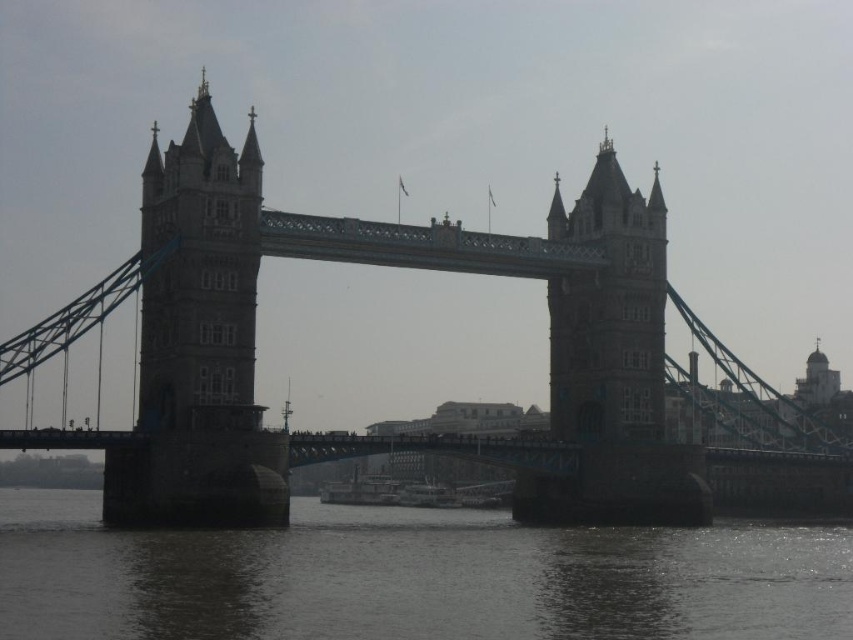
Between dark gray water at lower center and brown stone tower at center, which one appears on the right side from the viewer's perspective?

brown stone tower at center is more to the right.

Which is in front, point (461, 592) or point (619, 179)?

Point (461, 592)

Is point (489, 564) behind point (563, 356)?

No, it is not.

You are a GUI agent. You are given a task and a screenshot of the screen. Output one action in this format:
    pyautogui.click(x=<x>, y=<y>)
    Task: Click on the dark gray water at lower center
    The height and width of the screenshot is (640, 853).
    Given the screenshot: What is the action you would take?
    pyautogui.click(x=412, y=577)

Can you confirm if brown stone suspension bridge at center is positioned below gray stone tower at left?

Yes, brown stone suspension bridge at center is below gray stone tower at left.

Who is more forward, (264, 243) or (225, 144)?

Point (225, 144) is more forward.

Find the location of a particular element. This screenshot has width=853, height=640. brown stone suspension bridge at center is located at coordinates (378, 264).

Is gray stone tower at left closer to the viewer compared to brown stone tower at center?

Yes, gray stone tower at left is in front of brown stone tower at center.

Is point (175, 369) farther from viewer compared to point (552, 342)?

No, (175, 369) is in front of (552, 342).

At what (x,y) coordinates should I click in order to perform the action: click on gray stone tower at left. Please return your answer as a coordinate pair (x, y). Image resolution: width=853 pixels, height=640 pixels. Looking at the image, I should click on (199, 278).